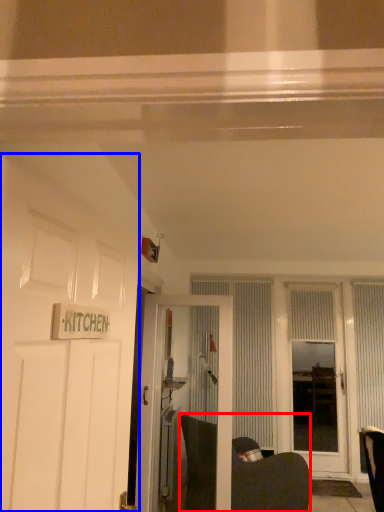
Question: Which of the following is the closest to the observer, swivel chair (highlighted by a red box) or door (highlighted by a blue box)?

Choices:
 (A) swivel chair
 (B) door

Answer: (B)